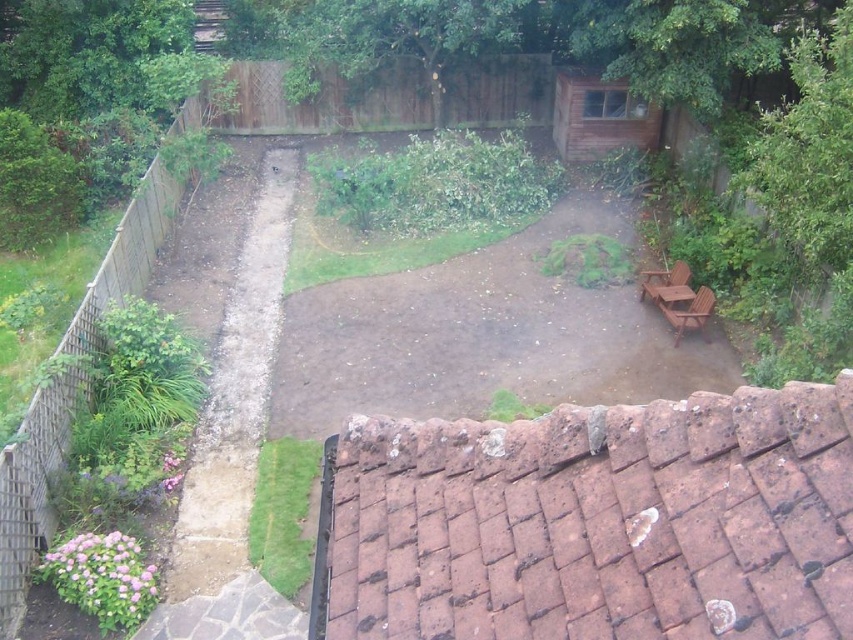
Who is positioned more to the left, green leafy tree at upper right or green leafy tree at upper center?

green leafy tree at upper center

Does green leafy tree at upper right have a greater width compared to green leafy tree at upper center?

Yes.

You are a GUI agent. You are given a task and a screenshot of the screen. Output one action in this format:
    pyautogui.click(x=<x>, y=<y>)
    Task: Click on the green leafy tree at upper right
    
    Given the screenshot: What is the action you would take?
    pyautogui.click(x=808, y=156)

Where is `green leafy tree at upper right`? The image size is (853, 640). green leafy tree at upper right is located at coordinates (808, 156).

Image resolution: width=853 pixels, height=640 pixels. What do you see at coordinates (392, 38) in the screenshot? I see `green leafy tree at upper center` at bounding box center [392, 38].

The width and height of the screenshot is (853, 640). Find the location of `green leafy tree at upper center`. green leafy tree at upper center is located at coordinates (392, 38).

Between point (473, 4) and point (596, 131), which one is positioned behind?

Point (596, 131)

Identify the location of green leafy tree at upper center. point(392,38).

Measure the distance between point (821, 163) and camera.

A distance of 10.38 meters exists between point (821, 163) and camera.

Is point (805, 237) more distant than point (560, 124)?

No, it is in front of (560, 124).

Identify the location of green leafy tree at upper right. This screenshot has width=853, height=640. (808, 156).